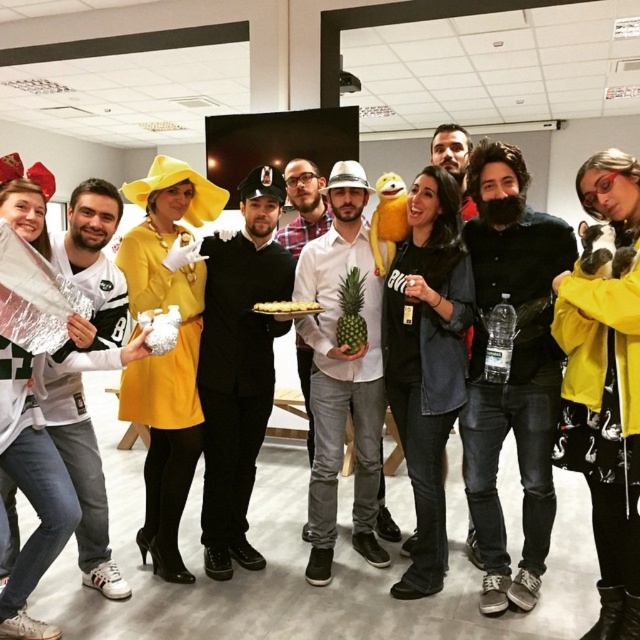
Question: Is the position of black denim jacket at center less distant than that of golden brown cake at center?

Choices:
 (A) no
 (B) yes

Answer: (B)

Question: Is black matte beard at center to the right of white matte pineapple at center from the viewer's perspective?

Choices:
 (A) yes
 (B) no

Answer: (A)

Question: Among these objects, which one is farthest from the camera?

Choices:
 (A) white jersey at left
 (B) matte black suit at center
 (C) golden brown cake at center

Answer: (B)

Question: Which point is closer to the camera?

Choices:
 (A) (74, 220)
 (B) (340, 376)
 (C) (248, 208)

Answer: (A)

Question: Can you confirm if matte black uniform at center is thinner than golden brown cake at center?

Choices:
 (A) yes
 (B) no

Answer: (B)

Question: Which object is farther from the camera taking this photo?

Choices:
 (A) matte black suit at center
 (B) matte black uniform at center

Answer: (A)